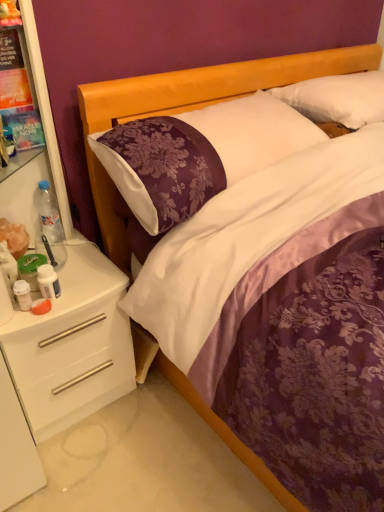
The height and width of the screenshot is (512, 384). Identify the location of free space to the right of clear plastic bottle at left, the 3th bottle from the front. (82, 249).